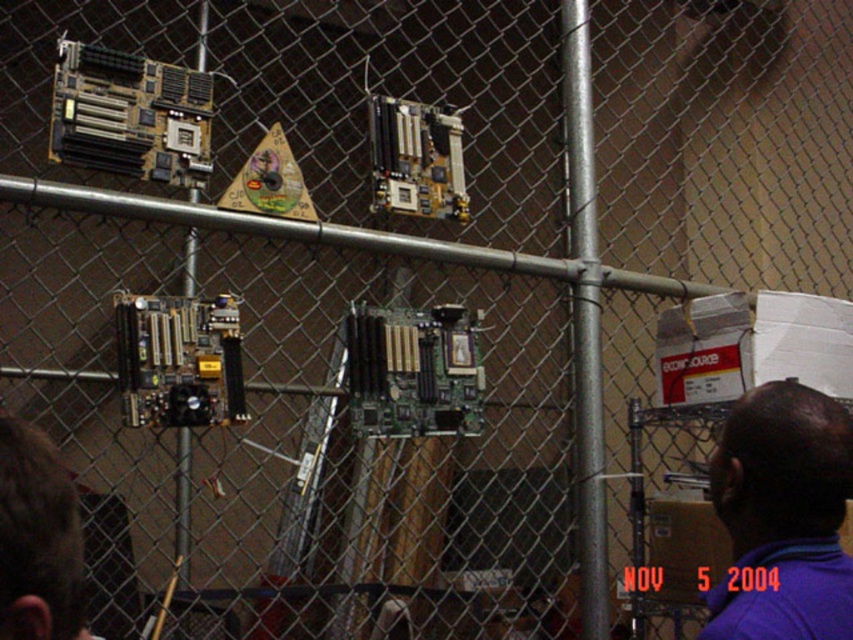
Question: Which point appears farthest from the camera in this image?

Choices:
 (A) (810, 413)
 (B) (13, 548)

Answer: (A)

Question: Is purple fabric shirt at upper right behind brown hair at lower left?

Choices:
 (A) no
 (B) yes

Answer: (B)

Question: Does purple fabric shirt at upper right appear over brown hair at lower left?

Choices:
 (A) yes
 (B) no

Answer: (B)

Question: Is purple fabric shirt at upper right above brown hair at lower left?

Choices:
 (A) yes
 (B) no

Answer: (B)

Question: Among these points, which one is farthest from the camera?

Choices:
 (A) (730, 632)
 (B) (80, 577)

Answer: (A)